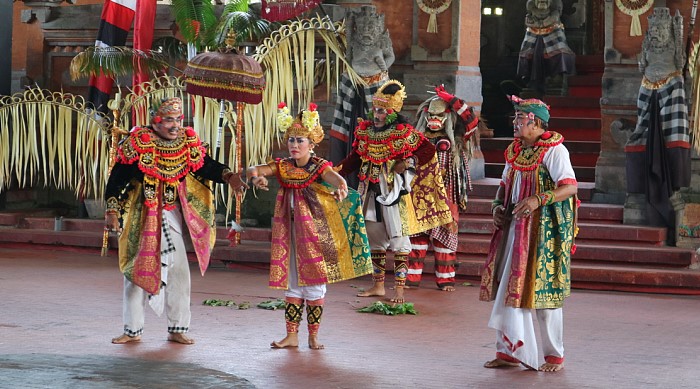
This screenshot has width=700, height=389. Find the location of `stairs`. stairs is located at coordinates (588, 88), (588, 115), (588, 140), (596, 65), (584, 165), (584, 191), (594, 209), (595, 229), (595, 245), (598, 269).